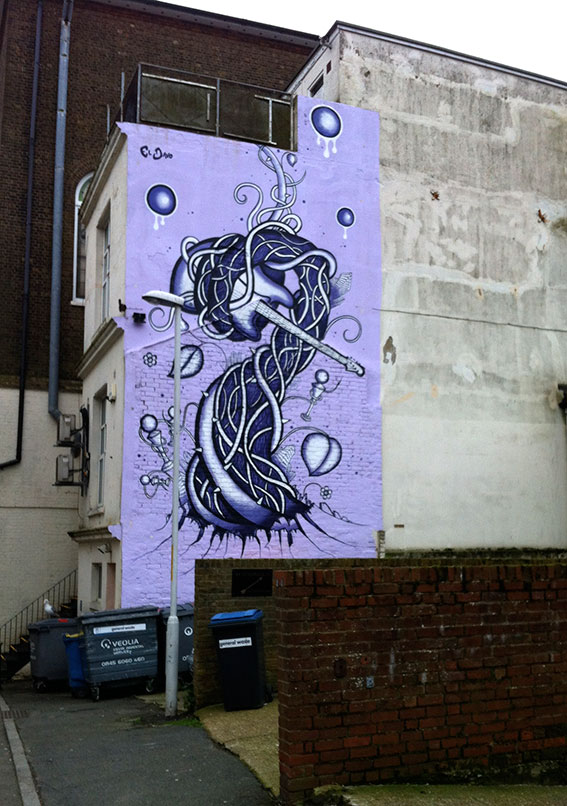
This screenshot has width=567, height=806. What are the coordinates of `stairs` in the screenshot? It's located at point(22,644).